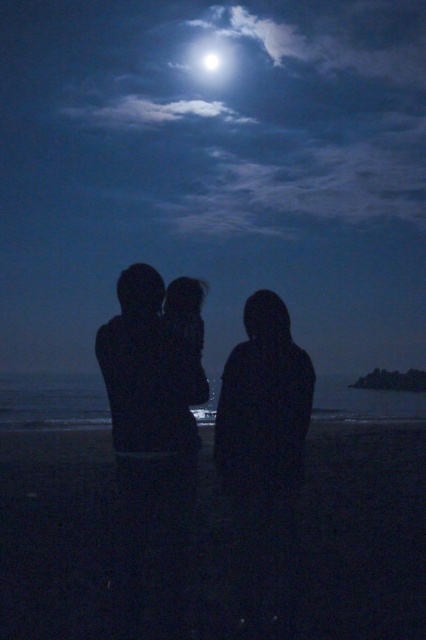
You are standing on the beach looking at the scene. Which object is closer to you, the dark sand at lower center or the bright white sphere at upper center?

The dark sand at lower center is closer to the viewer than the bright white sphere at upper center according to the description.

You are an astronomer observing the night sky and see the bright white orb at upper center and the bright white sphere at upper center. Which celestial object is closer to you?

The bright white orb at upper center is closer to the viewer than the bright white sphere at upper center.

You are standing on the beach looking at the two points marked in the image. Which point is closer to you, the point at coordinates point [172,483] or point [209,68]?

Point [172,483] is in front of point [209,68], so it is closer to you.